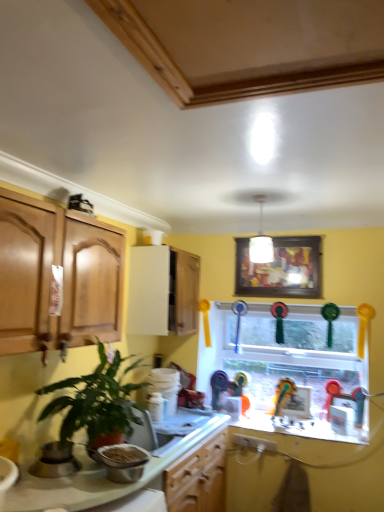
Image resolution: width=384 pixels, height=512 pixels. Identify the location of glass window at center. (290, 369).

The image size is (384, 512). What do you see at coordinates (96, 478) in the screenshot?
I see `white glossy countertop at lower center` at bounding box center [96, 478].

Where is `white glossy countertop at lower center`? white glossy countertop at lower center is located at coordinates (96, 478).

What do you see at coordinates (163, 291) in the screenshot? The image size is (384, 512). I see `white glossy cabinet at upper center` at bounding box center [163, 291].

How much space does metallic silver bowl at lower left, which appears as the first appliance when viewed from the right, occupy horizontally?

metallic silver bowl at lower left, which appears as the first appliance when viewed from the right, is 8.35 inches wide.

Where is `metallic silver bowl at lower left, which is counted as the 2th appliance, starting from the left`? The width and height of the screenshot is (384, 512). metallic silver bowl at lower left, which is counted as the 2th appliance, starting from the left is located at coordinates (122, 461).

Find the location of a particular element. This screenshot has width=384, height=512. satin silver pot at lower left, the first appliance positioned from the left is located at coordinates (55, 461).

Find the location of a particular element. This screenshot has width=384, height=512. glass window at center is located at coordinates (290, 369).

From a real-world perspective, which is physically below, white glossy cabinet at upper center or green glossy plant at lower left?

In real-world perspective, green glossy plant at lower left is lower.

Is white glossy cabinet at upper center outside of green glossy plant at lower left?

Yes, white glossy cabinet at upper center is not within green glossy plant at lower left.

Is white glossy cabinet at upper center facing towards green glossy plant at lower left?

No, white glossy cabinet at upper center does not turn towards green glossy plant at lower left.

Consider the image. Is the surface of white glossy cabinet at upper center in direct contact with green glossy plant at lower left?

No.

Can you confirm if glass window at center is wider than white glossy countertop at lower center?

No.

Looking at this image, considering the positions of objects glass window at center and white glossy countertop at lower center in the image provided, who is more to the right, glass window at center or white glossy countertop at lower center?

Positioned to the right is glass window at center.

Considering the positions of objects glass window at center and white glossy countertop at lower center in the image provided, who is behind, glass window at center or white glossy countertop at lower center?

glass window at center is further from the camera.

Who is taller, satin silver pot at lower left, the first appliance positioned from the left, or white glossy cabinet at upper center?

With more height is white glossy cabinet at upper center.

Are satin silver pot at lower left, the first appliance positioned from the left, and white glossy cabinet at upper center located far from each other?

Yes, satin silver pot at lower left, the first appliance positioned from the left, is far from white glossy cabinet at upper center.

From a real-world perspective, is satin silver pot at lower left, the first appliance positioned from the left, on white glossy cabinet at upper center?

No, from a real-world perspective, satin silver pot at lower left, the first appliance positioned from the left, is not over white glossy cabinet at upper center

Can you confirm if metallic silver bowl at lower left, which appears as the first appliance when viewed from the right, is thinner than white glossy cabinet at upper center?

Yes, metallic silver bowl at lower left, which appears as the first appliance when viewed from the right, is thinner than white glossy cabinet at upper center.

Is metallic silver bowl at lower left, which appears as the first appliance when viewed from the right, beside white glossy cabinet at upper center?

No, metallic silver bowl at lower left, which appears as the first appliance when viewed from the right, is not in contact with white glossy cabinet at upper center.

From the image's perspective, is metallic silver bowl at lower left, which is counted as the 2th appliance, starting from the left, located above or below white glossy cabinet at upper center?

metallic silver bowl at lower left, which is counted as the 2th appliance, starting from the left, is situated lower than white glossy cabinet at upper center in the image.

Between metallic silver bowl at lower left, which appears as the first appliance when viewed from the right, and white glossy cabinet at upper center, which one appears on the right side from the viewer's perspective?

From the viewer's perspective, white glossy cabinet at upper center appears more on the right side.

Can you confirm if wooden framed picture at upper center is wider than white glossy cabinet at upper center?

No.

Looking at this image, choose the correct answer: Is wooden framed picture at upper center inside white glossy cabinet at upper center or outside it?

wooden framed picture at upper center is spatially situated outside white glossy cabinet at upper center.

Between wooden framed picture at upper center and white glossy cabinet at upper center, which one appears on the left side from the viewer's perspective?

white glossy cabinet at upper center.

From the image's perspective, is wooden framed picture at upper center located above or below white glossy cabinet at upper center?

wooden framed picture at upper center is situated higher than white glossy cabinet at upper center in the image.

From a real-world perspective, which is physically below, white glossy cabinet at upper center or white glossy countertop at lower center?

From a 3D spatial view, white glossy countertop at lower center is below.

From the image's perspective, which is below, white glossy cabinet at upper center or white glossy countertop at lower center?

From the image's view, white glossy countertop at lower center is below.

Locate an element on the screen. This screenshot has width=384, height=512. cabinetry behind the white glossy countertop at lower center is located at coordinates (163, 291).

Is white glossy cabinet at upper center bigger or smaller than white glossy countertop at lower center?

Clearly, white glossy cabinet at upper center is larger in size than white glossy countertop at lower center.

Which is in front, green glossy plant at lower left or white glossy cabinet at upper center?

green glossy plant at lower left is in front.

Consider the image. Does green glossy plant at lower left have a larger size compared to white glossy cabinet at upper center?

Indeed, green glossy plant at lower left has a larger size compared to white glossy cabinet at upper center.

Does green glossy plant at lower left have a lesser height compared to white glossy cabinet at upper center?

Yes.

Does green glossy plant at lower left appear on the right side of white glossy cabinet at upper center?

In fact, green glossy plant at lower left is to the left of white glossy cabinet at upper center.

The image size is (384, 512). In order to click on cabinetry above the green glossy plant at lower left (from a real-world perspective) in this screenshot , I will do `click(163, 291)`.

You are a GUI agent. You are given a task and a screenshot of the screen. Output one action in this format:
    pyautogui.click(x=<x>, y=<y>)
    Task: Click on the countertop below the glass window at center (from the image's perspective)
    
    Given the screenshot: What is the action you would take?
    pyautogui.click(x=96, y=478)

Based on their spatial positions, is wooden framed picture at upper center or metallic silver bowl at lower left, which appears as the first appliance when viewed from the right, closer to white glossy countertop at lower center?

The object closer to white glossy countertop at lower center is metallic silver bowl at lower left, which appears as the first appliance when viewed from the right.

From the image, which object appears to be farther from satin silver pot at lower left, which is the second appliance in right-to-left order, glass window at center or wooden framed picture at upper center?

glass window at center lies further to satin silver pot at lower left, which is the second appliance in right-to-left order, than the other object.

Looking at the image, which one is located further to wooden framed picture at upper center, metallic silver bowl at lower left, which appears as the first appliance when viewed from the right, or green glossy plant at lower left?

metallic silver bowl at lower left, which appears as the first appliance when viewed from the right.

From the image, which object appears to be farther from white glossy countertop at lower center, metallic silver bowl at lower left, which appears as the first appliance when viewed from the right, or satin silver pot at lower left, the first appliance positioned from the left?

The object further to white glossy countertop at lower center is satin silver pot at lower left, the first appliance positioned from the left.

Looking at the image, which one is located further to wooden framed picture at upper center, metallic silver bowl at lower left, which appears as the first appliance when viewed from the right, or satin silver pot at lower left, which is the second appliance in right-to-left order?

Based on the image, satin silver pot at lower left, which is the second appliance in right-to-left order, appears to be further to wooden framed picture at upper center.

From the image, which object appears to be nearer to white glossy cabinet at upper center, glass window at center or green glossy plant at lower left?

glass window at center is positioned closer to the anchor white glossy cabinet at upper center.

When comparing their distances from satin silver pot at lower left, the first appliance positioned from the left, does glass window at center or metallic silver bowl at lower left, which appears as the first appliance when viewed from the right, seem further?

The object further to satin silver pot at lower left, the first appliance positioned from the left, is glass window at center.

Considering their positions, is white glossy countertop at lower center positioned closer to wooden framed picture at upper center than white glossy cabinet at upper center?

white glossy cabinet at upper center is closer to wooden framed picture at upper center.

Identify the location of countertop positioned between green glossy plant at lower left and wooden framed picture at upper center from near to far. (96, 478).

Find the location of a particular element. appliance located between metallic silver bowl at lower left, which is counted as the 2th appliance, starting from the left, and white glossy cabinet at upper center in the depth direction is located at coordinates (55, 461).

You are a GUI agent. You are given a task and a screenshot of the screen. Output one action in this format:
    pyautogui.click(x=<x>, y=<y>)
    Task: Click on the countertop located between metallic silver bowl at lower left, which appears as the first appliance when viewed from the right, and white glossy cabinet at upper center in the depth direction
    
    Given the screenshot: What is the action you would take?
    pyautogui.click(x=96, y=478)

Find the location of `cabinetry between wooden framed picture at upper center and white glossy countertop at lower center from top to bottom`. cabinetry between wooden framed picture at upper center and white glossy countertop at lower center from top to bottom is located at coordinates (163, 291).